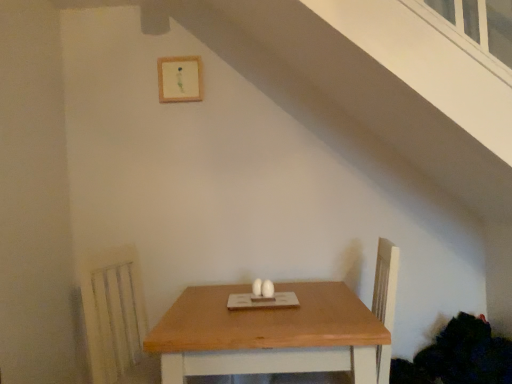
Question: Is wooden frame at upper center aimed at natural wood table at center?

Choices:
 (A) yes
 (B) no

Answer: (B)

Question: Does wooden frame at upper center touch natural wood table at center?

Choices:
 (A) no
 (B) yes

Answer: (A)

Question: Is wooden frame at upper center looking in the opposite direction of natural wood table at center?

Choices:
 (A) yes
 (B) no

Answer: (B)

Question: Can you confirm if wooden frame at upper center is thinner than natural wood table at center?

Choices:
 (A) yes
 (B) no

Answer: (A)

Question: Would you say natural wood table at center is part of wooden frame at upper center's contents?

Choices:
 (A) no
 (B) yes

Answer: (A)

Question: Is wooden frame at upper center positioned far away from natural wood table at center?

Choices:
 (A) no
 (B) yes

Answer: (B)

Question: Is natural wood table at center with wooden frame at upper center?

Choices:
 (A) no
 (B) yes

Answer: (A)

Question: Is wooden frame at upper center a part of natural wood table at center?

Choices:
 (A) yes
 (B) no

Answer: (B)

Question: Does natural wood table at center have a greater height compared to wooden frame at upper center?

Choices:
 (A) yes
 (B) no

Answer: (A)

Question: Are natural wood table at center and wooden frame at upper center located far from each other?

Choices:
 (A) no
 (B) yes

Answer: (B)

Question: Is natural wood table at center closer to camera compared to wooden frame at upper center?

Choices:
 (A) yes
 (B) no

Answer: (A)

Question: From the image's perspective, is natural wood table at center above wooden frame at upper center?

Choices:
 (A) no
 (B) yes

Answer: (A)

Question: Looking at the image, does natural wood table at center seem bigger or smaller compared to wooden frame at upper center?

Choices:
 (A) big
 (B) small

Answer: (A)